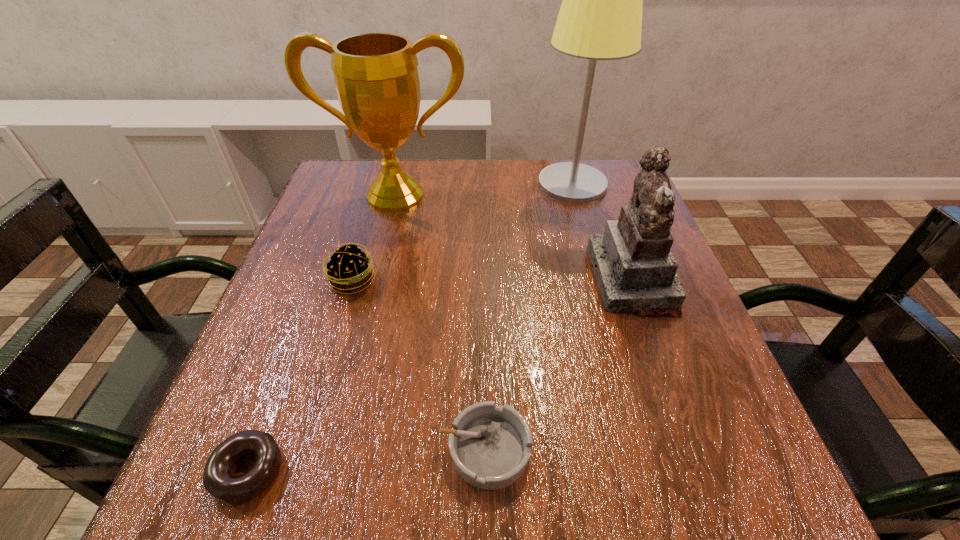
Find the location of a particular element. Image resolution: width=960 pixels, height=540 pixels. the tallest object is located at coordinates (600, 18).

This screenshot has width=960, height=540. What are the coordinates of `award` in the screenshot? It's located at (376, 77).

Where is `figurine`? The height and width of the screenshot is (540, 960). figurine is located at coordinates (635, 270).

This screenshot has height=540, width=960. Find the location of `patty`. patty is located at coordinates (348, 269).

Identify the location of ashtray. Image resolution: width=960 pixels, height=540 pixels. (490, 446).

Locate an element on the screen. This screenshot has height=540, width=960. doughnut is located at coordinates (219, 481).

I want to click on vacant space located on the front of the tallest object, so click(607, 310).

This screenshot has height=540, width=960. I want to click on free location located 0.070m on the front-facing side of the fifth shortest object, so click(386, 235).

In order to click on blank area located 0.270m on the front-facing side of the figurine in this screenshot , I will do `click(460, 280)`.

At what (x,y) coordinates should I click in order to perform the action: click on free region located 0.330m on the front-facing side of the figurine. Please return your answer as a coordinate pair (x, y). Looking at the image, I should click on (430, 280).